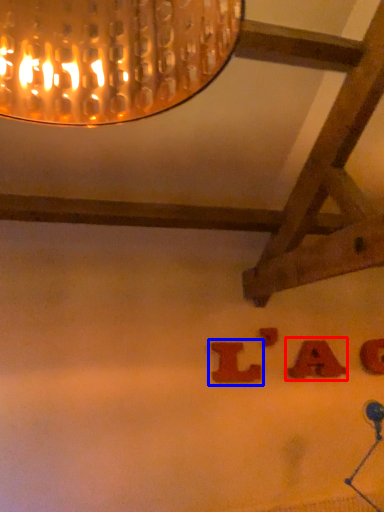
Question: Among these objects, which one is farthest to the camera, alphabet (highlighted by a red box) or alphabet (highlighted by a blue box)?

Choices:
 (A) alphabet
 (B) alphabet

Answer: (A)